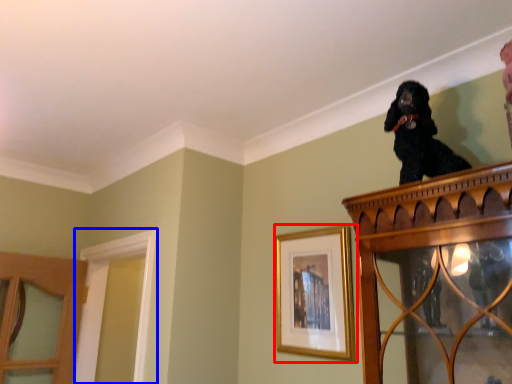
Question: Which of the following is the closest to the observer, picture frame (highlighted by a red box) or window frame (highlighted by a blue box)?

Choices:
 (A) picture frame
 (B) window frame

Answer: (A)